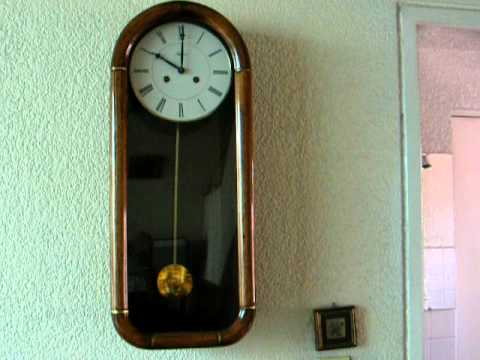
At what (x,y) coordinates should I click in order to perform the action: click on window. Please return your answer as a coordinate pair (x, y). The height and width of the screenshot is (360, 480). Looking at the image, I should click on (438, 236).